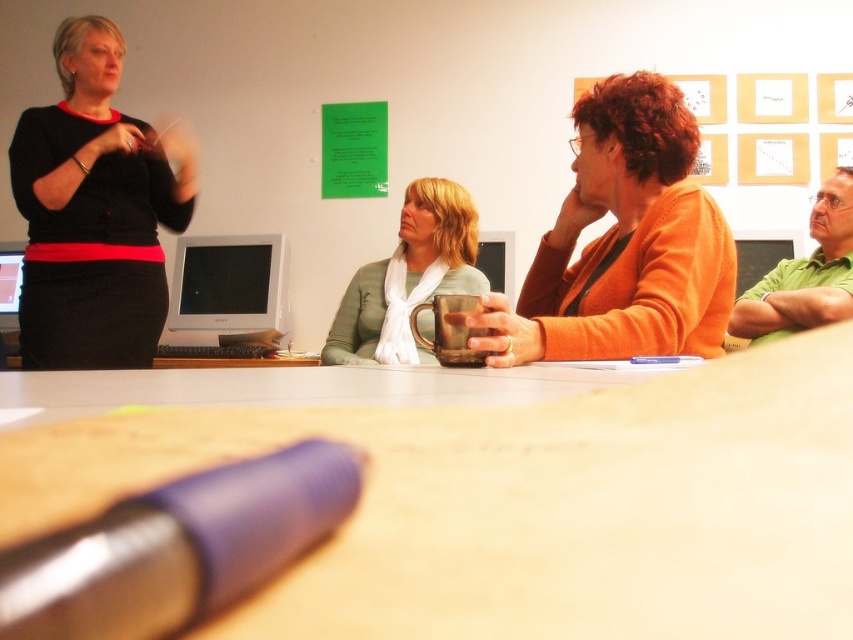
You are a barista preparing drinks for a meeting. You need to place the black matte sweater at upper left and the matte silver mug at center on a shelf. The shelf has a height limit of 15 cm. Can both items fit vertically on the shelf without exceeding the height limit?

The black matte sweater at upper left has a greater height compared to the matte silver mug at center. Since the shelf has a height limit of 15 cm, both items can fit vertically as long as the tallest item, the black matte sweater at upper left, is under 15 cm. However, the exact heights aren

Consider the image. You are a person standing at the camera position. You want to grab the matte silver mug at center. Is it within your reach?

The matte silver mug at center is 2.19 meters away from camera. Since the average human arm length is about 0.7 meters, it is too far to reach without moving closer.